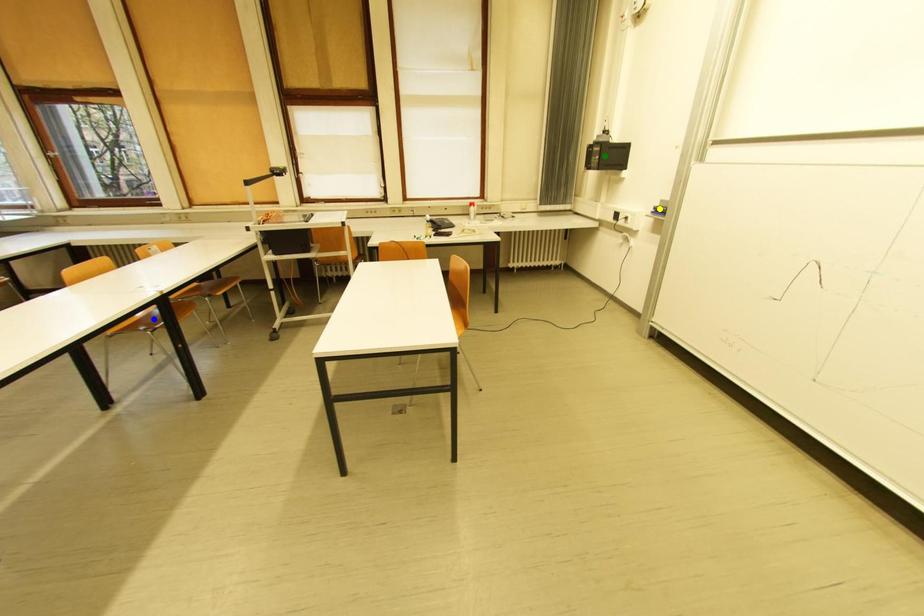
Order these from nearest to farthest:
- yellow point
- green point
- blue point

1. blue point
2. yellow point
3. green point